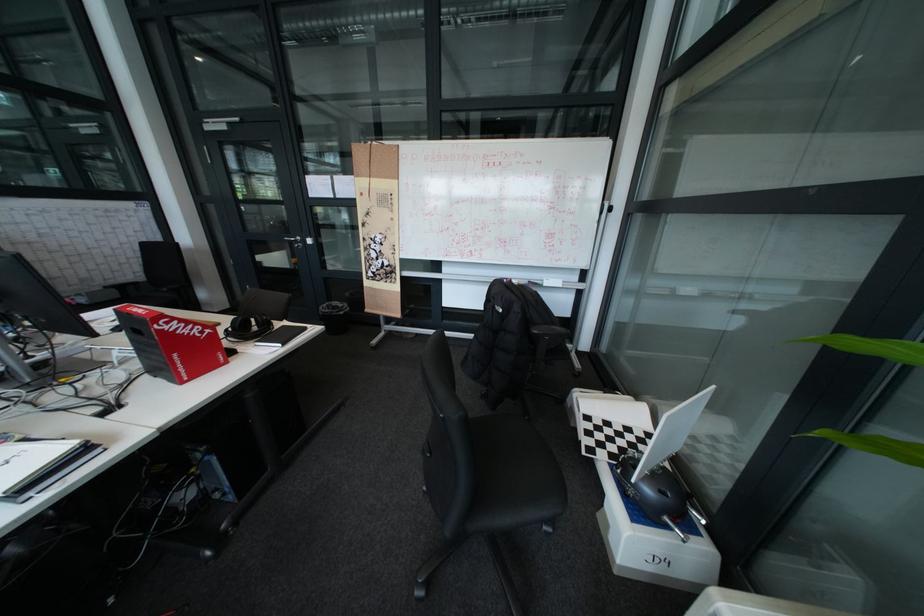
Find the location of `black headphones`. black headphones is located at coordinates (247, 328).